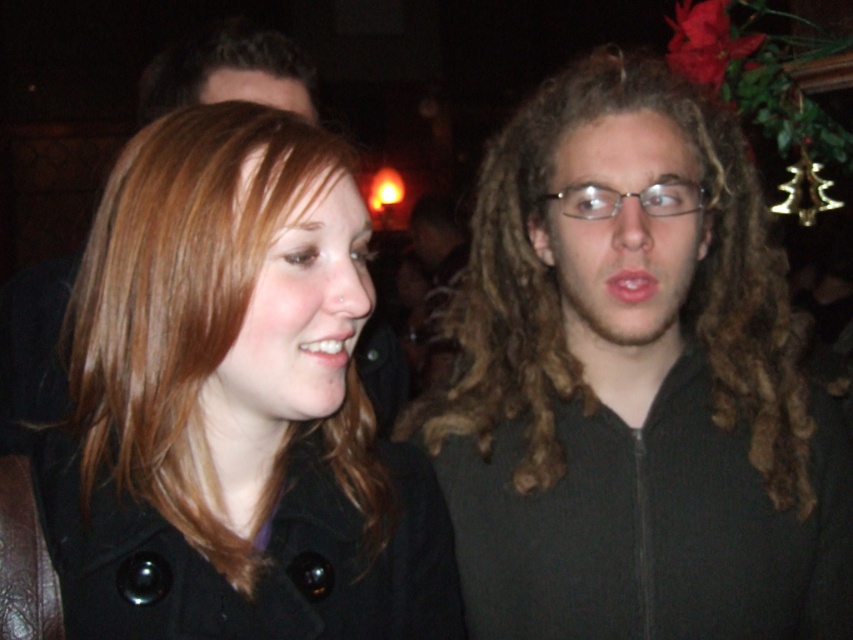
You are taking a photo of two people in a dimly lit room. You notice two points of light in the image at coordinates point (306, 262) and point (653, 208). Which point is closer to your camera lens?

Point (306, 262) is closer to the camera than point (653, 208).

You are a photographer trying to capture a closeup shot of the clear plastic glasses at center without including the curly brown hair at center in the frame. Given their relative sizes, is this feasible?

The curly brown hair at center is wider than the clear plastic glasses at center, so it might be challenging to frame the glasses without including some of the hair, especially if they are positioned closely together.